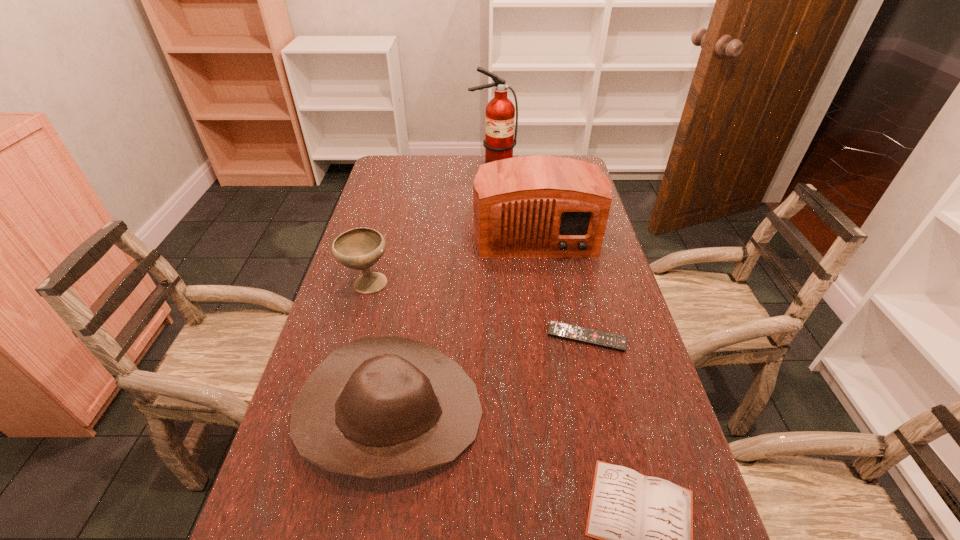
In the image, there is a desktop. Where is `vacant region at the far right corner`? This screenshot has width=960, height=540. vacant region at the far right corner is located at coordinates (556, 156).

Locate an element on the screen. Image resolution: width=960 pixels, height=540 pixels. vacant space that is in between the tallest object and the fourth nearest object is located at coordinates (430, 223).

Find the location of a particular element. empty space between the chalice and the fifth shortest object is located at coordinates (451, 258).

The height and width of the screenshot is (540, 960). In order to click on free space between the cowboy hat and the fifth shortest object in this screenshot , I will do tap(463, 322).

Locate an element on the screen. empty space that is in between the shortest object and the cowboy hat is located at coordinates (488, 376).

Identify which object is the second closest to the second farthest object. Please provide its 2D coordinates. Your answer should be formatted as a tuple, i.e. [(x, y)], where the tuple contains the x and y coordinates of a point satisfying the conditions above.

[(617, 342)]

This screenshot has width=960, height=540. Identify the location of the fourth closest object to the chalice. (644, 525).

The height and width of the screenshot is (540, 960). Find the location of `vacant space that satisfies the following two spatial constraints: 1. on the front side of the chalice; 2. on the left side of the cowboy hat`. vacant space that satisfies the following two spatial constraints: 1. on the front side of the chalice; 2. on the left side of the cowboy hat is located at coordinates (331, 413).